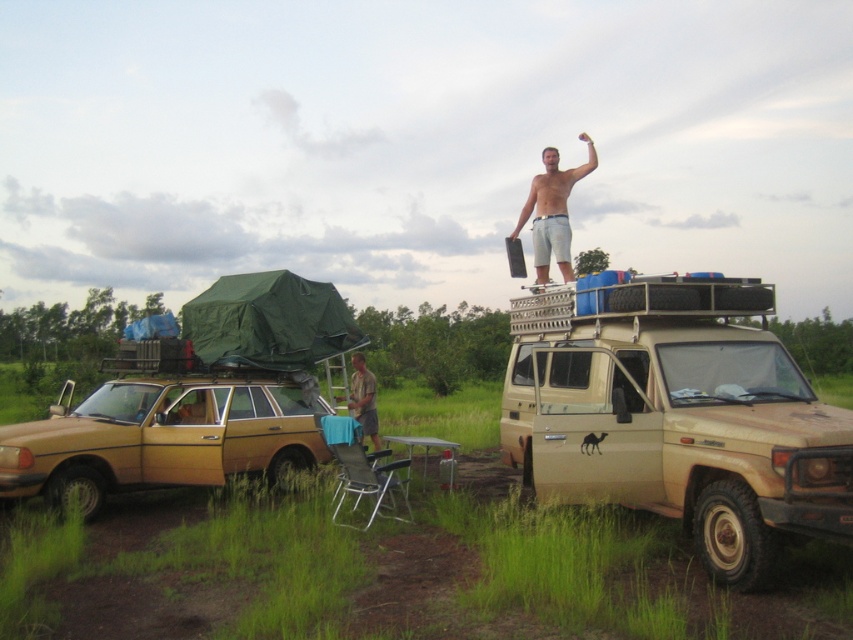
You are a photographer trying to capture both the beige matte pickup truck at upper right and the brown fabric shirt at center in a single shot. Based on their positions, which object should you focus on first to ensure both are in frame?

The beige matte pickup truck at upper right is in front of the brown fabric shirt at center, so you should focus on the brown fabric shirt at center first to ensure both are in frame.

You are a hiker who wants to take a photo of the beige matte pickup truck at upper right and the brown fabric shirt at center. Which object should you point your camera towards first if you want to capture both in a single frame without moving the camera?

You should point your camera towards the brown fabric shirt at center first because the beige matte pickup truck at upper right is to the right of it, so by centering on the shirt first, you can include both in the frame without moving the camera.